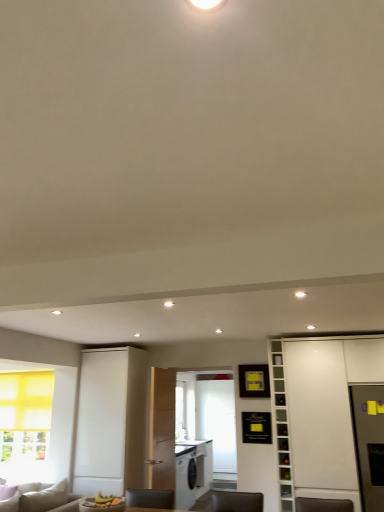
Question: Is white glossy bookshelf at right next to white matte cabinet at right and touching it?

Choices:
 (A) yes
 (B) no

Answer: (B)

Question: Considering the relative positions of white glossy bookshelf at right and white matte cabinet at right in the image provided, is white glossy bookshelf at right to the right of white matte cabinet at right from the viewer's perspective?

Choices:
 (A) no
 (B) yes

Answer: (A)

Question: From the image's perspective, is white glossy bookshelf at right located above white matte cabinet at right?

Choices:
 (A) yes
 (B) no

Answer: (B)

Question: Is white glossy bookshelf at right smaller than white matte cabinet at right?

Choices:
 (A) yes
 (B) no

Answer: (A)

Question: Does white glossy bookshelf at right turn towards white matte cabinet at right?

Choices:
 (A) yes
 (B) no

Answer: (B)

Question: Would you consider white glossy bookshelf at right to be distant from white matte cabinet at right?

Choices:
 (A) no
 (B) yes

Answer: (A)

Question: Does white matte cabinet at right have a greater height compared to white glossy bookshelf at right?

Choices:
 (A) yes
 (B) no

Answer: (A)

Question: Is white matte cabinet at right thinner than white glossy bookshelf at right?

Choices:
 (A) no
 (B) yes

Answer: (A)

Question: Is white matte cabinet at right positioned with its back to white glossy bookshelf at right?

Choices:
 (A) no
 (B) yes

Answer: (A)

Question: Is white matte cabinet at right behind white glossy bookshelf at right?

Choices:
 (A) yes
 (B) no

Answer: (B)

Question: Is white matte cabinet at right shorter than white glossy bookshelf at right?

Choices:
 (A) yes
 (B) no

Answer: (B)

Question: Is white matte cabinet at right wider than white glossy bookshelf at right?

Choices:
 (A) no
 (B) yes

Answer: (B)

Question: Is point (279, 397) closer or farther from the camera than point (327, 337)?

Choices:
 (A) closer
 (B) farther

Answer: (A)